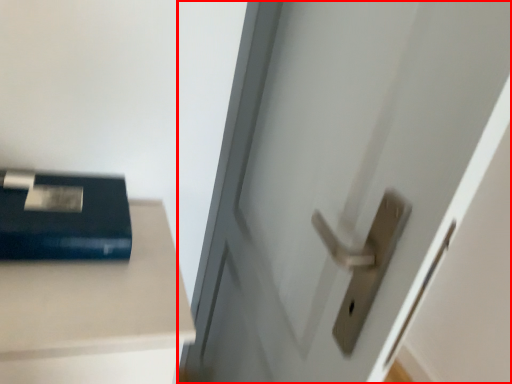
Question: Observing the image, what is the correct spatial positioning of door (annotated by the red box) in reference to paperback book?

Choices:
 (A) left
 (B) right

Answer: (B)